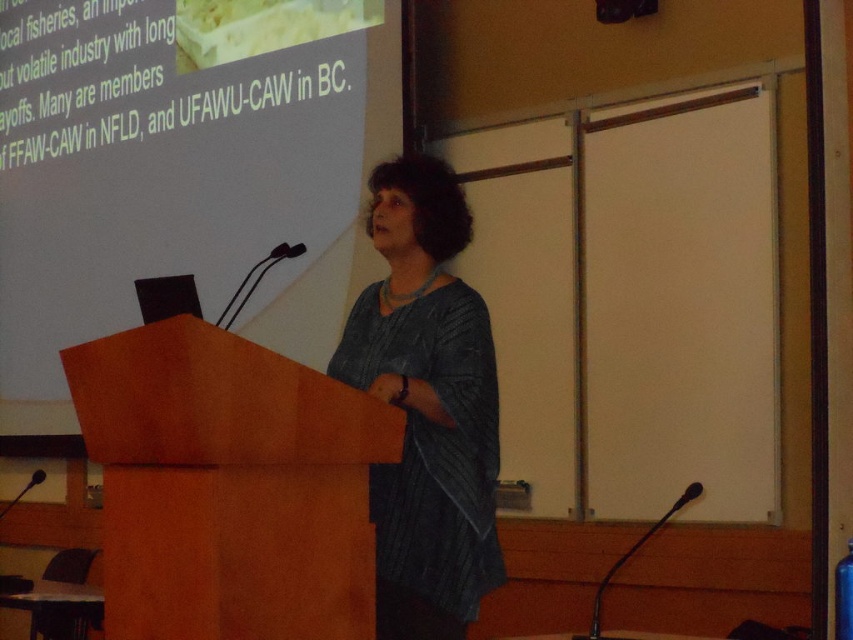
Question: Which of the following is the farthest from the observer?

Choices:
 (A) (311, 88)
 (B) (163, 588)
 (C) (433, 196)

Answer: (A)

Question: Does white matte projection screen at upper center lie in front of wooden podium at center?

Choices:
 (A) no
 (B) yes

Answer: (A)

Question: Can you confirm if wooden podium at center is positioned to the left of textured gray sweater at center?

Choices:
 (A) no
 (B) yes

Answer: (B)

Question: Which point appears farthest from the camera in this image?

Choices:
 (A) (267, 628)
 (B) (387, 192)
 (C) (142, 152)

Answer: (C)

Question: Considering the real-world distances, which object is farthest from the white matte projection screen at upper center?

Choices:
 (A) wooden podium at center
 (B) textured gray sweater at center

Answer: (A)

Question: Is wooden podium at center bigger than textured gray sweater at center?

Choices:
 (A) yes
 (B) no

Answer: (B)